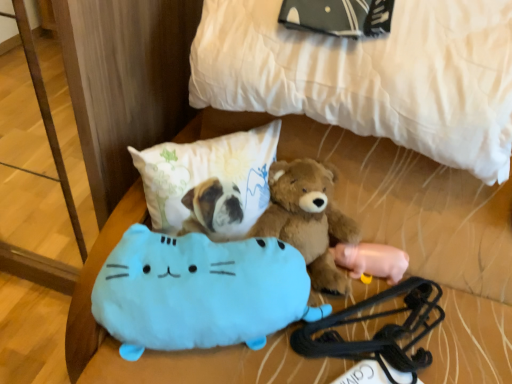
Question: Is pink rubber pig at lower right, acting as the 1th toy starting from the right, placed right next to white quilted bed at upper center?

Choices:
 (A) no
 (B) yes

Answer: (A)

Question: Considering the relative sizes of pink rubber pig at lower right, acting as the 2th toy starting from the front, and white quilted bed at upper center in the image provided, is pink rubber pig at lower right, acting as the 2th toy starting from the front, wider than white quilted bed at upper center?

Choices:
 (A) no
 (B) yes

Answer: (A)

Question: Considering the relative sizes of pink rubber pig at lower right, the 2th toy viewed from the left, and white quilted bed at upper center in the image provided, is pink rubber pig at lower right, the 2th toy viewed from the left, shorter than white quilted bed at upper center?

Choices:
 (A) yes
 (B) no

Answer: (A)

Question: Is pink rubber pig at lower right, the 2th toy viewed from the left, to the right of white quilted bed at upper center from the viewer's perspective?

Choices:
 (A) yes
 (B) no

Answer: (A)

Question: Is the position of pink rubber pig at lower right, acting as the 2th toy starting from the front, less distant than that of white quilted bed at upper center?

Choices:
 (A) yes
 (B) no

Answer: (B)

Question: Is point (493, 31) positioned closer to the camera than point (96, 288)?

Choices:
 (A) closer
 (B) farther

Answer: (A)

Question: Is white quilted bed at upper center wider or thinner than light blue plush cat at lower center, marked as the second toy in a back-to-front arrangement?

Choices:
 (A) thin
 (B) wide

Answer: (B)

Question: From their relative heights in the image, would you say white quilted bed at upper center is taller or shorter than light blue plush cat at lower center, marked as the second toy in a back-to-front arrangement?

Choices:
 (A) tall
 (B) short

Answer: (A)

Question: Based on their positions, is white quilted bed at upper center located to the left or right of light blue plush cat at lower center, the 1th toy from the left?

Choices:
 (A) left
 (B) right

Answer: (B)

Question: Is fluffy white pillow at center wider or thinner than pink rubber pig at lower right, placed as the first toy when sorted from back to front?

Choices:
 (A) wide
 (B) thin

Answer: (A)

Question: Would you say fluffy white pillow at center is inside or outside pink rubber pig at lower right, placed as the first toy when sorted from back to front?

Choices:
 (A) outside
 (B) inside

Answer: (A)

Question: Is point (153, 223) closer or farther from the camera than point (378, 258)?

Choices:
 (A) farther
 (B) closer

Answer: (B)

Question: Relative to pink rubber pig at lower right, acting as the 2th toy starting from the front, is fluffy white pillow at center in front or behind?

Choices:
 (A) behind
 (B) front

Answer: (B)

Question: Does point (414, 339) appear closer or farther from the camera than point (438, 157)?

Choices:
 (A) farther
 (B) closer

Answer: (A)

Question: From a real-world perspective, is black rubber luggage strap at lower right positioned above or below white quilted bed at upper center?

Choices:
 (A) above
 (B) below

Answer: (B)